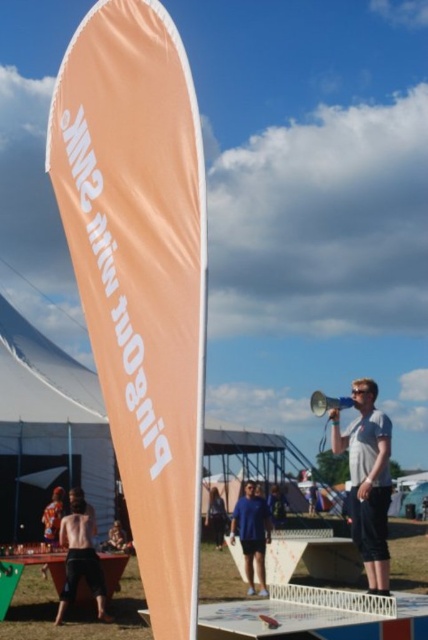
Is orange fabric banner at left shorter than metallic silver megaphone at center?

Yes, orange fabric banner at left is shorter than metallic silver megaphone at center.

Is point (158, 568) closer to viewer compared to point (314, 406)?

That is True.

Find the location of `orange fabric banner at left`. orange fabric banner at left is located at coordinates (140, 273).

Does white cotton shirt at upper right come in front of dark blue jeans at center?

Yes, white cotton shirt at upper right is in front of dark blue jeans at center.

From the picture: Does white cotton shirt at upper right appear under dark blue jeans at center?

No, white cotton shirt at upper right is not below dark blue jeans at center.

Does point (356, 438) lie behind point (219, 509)?

That is False.

Where is `white cotton shirt at upper right`? white cotton shirt at upper right is located at coordinates (368, 481).

Between point (368, 518) and point (50, 540), which one is positioned behind?

The point (50, 540) is more distant.

This screenshot has height=640, width=428. What are the coordinates of `white cotton shirt at upper right` in the screenshot? It's located at (368, 481).